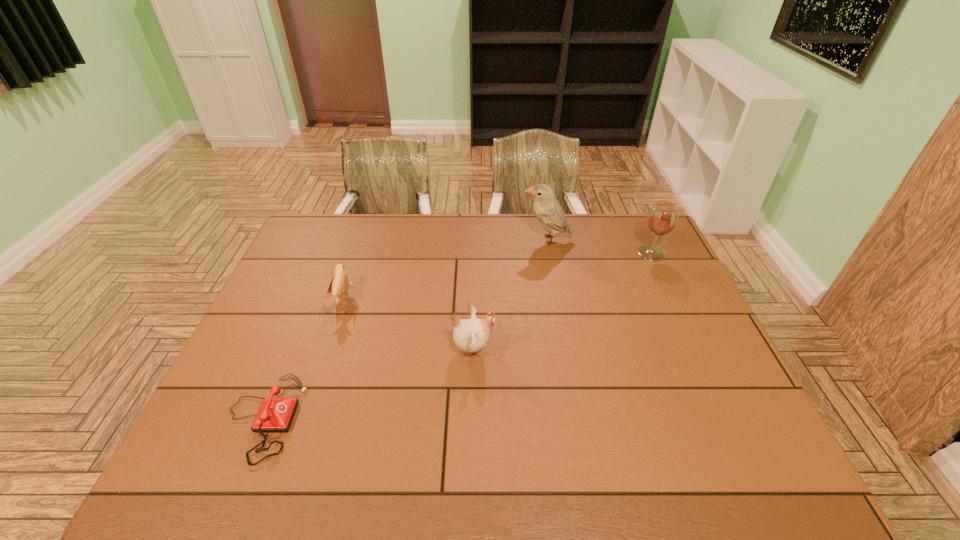
Find the location of a particular element. The image size is (960, 540). the farthest bird is located at coordinates (548, 211).

The height and width of the screenshot is (540, 960). Find the location of `the rightmost bird`. the rightmost bird is located at coordinates (548, 211).

What are the coordinates of `the rightmost object` in the screenshot? It's located at (662, 217).

Find the location of a particular element. Image resolution: width=960 pixels, height=540 pixels. the second tallest object is located at coordinates (662, 217).

Image resolution: width=960 pixels, height=540 pixels. I want to click on the second bird from right to left, so click(x=470, y=335).

Locate an element on the screen. This screenshot has height=540, width=960. the third shortest object is located at coordinates tap(470, 335).

This screenshot has width=960, height=540. What are the coordinates of `the shortest bird` in the screenshot? It's located at (339, 285).

This screenshot has height=540, width=960. What are the coordinates of `the third farthest object` in the screenshot? It's located at (339, 285).

Identify the location of the shortest object. The image size is (960, 540). (275, 414).

You are a GUI agent. You are given a task and a screenshot of the screen. Output one action in this format:
    pyautogui.click(x=<x>, y=<y>)
    Task: Click on the vacant region located 0.270m at the face of the tallest object
    The width and height of the screenshot is (960, 540).
    Given the screenshot: What is the action you would take?
    pyautogui.click(x=445, y=240)